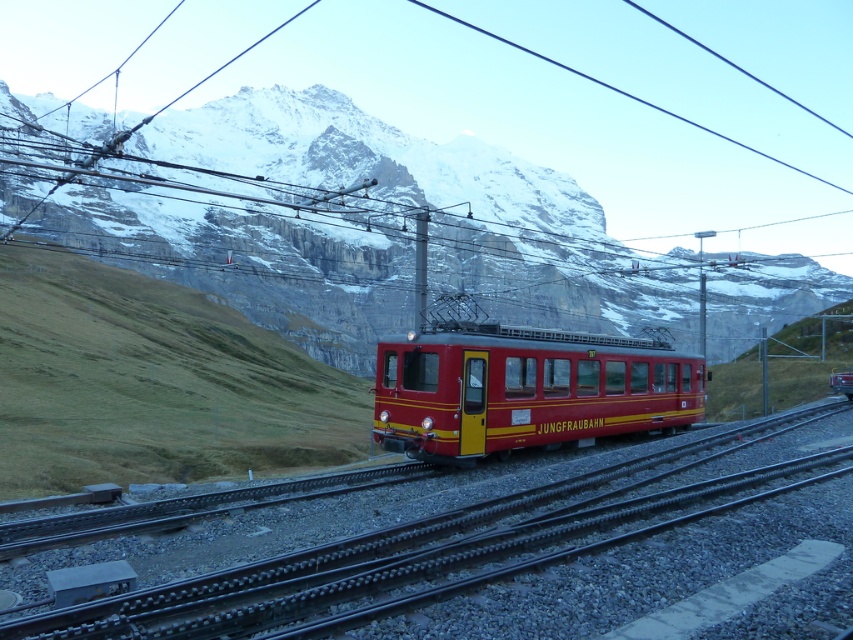
Question: Which of the following is the farthest from the observer?

Choices:
 (A) (413, 333)
 (B) (518, 509)

Answer: (A)

Question: Which object is positioned farthest from the snowy rock at center?

Choices:
 (A) matte red train at center
 (B) metallic train track at center

Answer: (B)

Question: Is snowy rock at center positioned at the back of metallic train track at center?

Choices:
 (A) yes
 (B) no

Answer: (A)

Question: Is snowy rock at center positioned before metallic train track at center?

Choices:
 (A) no
 (B) yes

Answer: (A)

Question: Considering the relative positions of snowy rock at center and matte red train at center in the image provided, where is snowy rock at center located with respect to matte red train at center?

Choices:
 (A) below
 (B) above

Answer: (B)

Question: Based on their relative distances, which object is farther from the snowy rock at center?

Choices:
 (A) metallic train track at center
 (B) matte red train at center

Answer: (A)